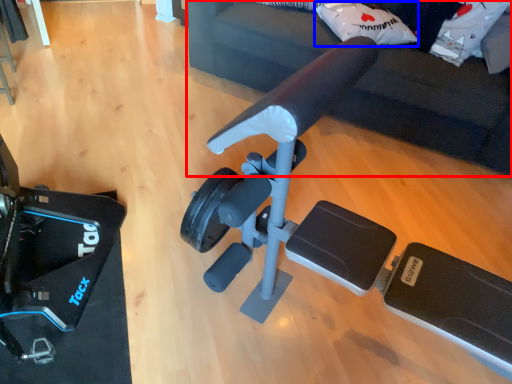
Question: Which object appears farthest to the camera in this image, furniture (highlighted by a red box) or pillow (highlighted by a blue box)?

Choices:
 (A) furniture
 (B) pillow

Answer: (B)